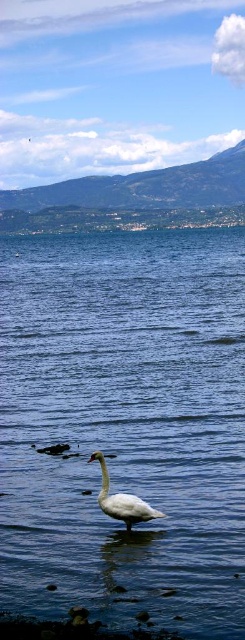
Does blue water at center lie in front of white matte swan at center?

That is True.

Between point (174, 401) and point (134, 509), which one is positioned behind?

Positioned behind is point (174, 401).

What do you see at coordinates (124, 426) in the screenshot?
I see `blue water at center` at bounding box center [124, 426].

Find the location of `blue water at center`. blue water at center is located at coordinates (124, 426).